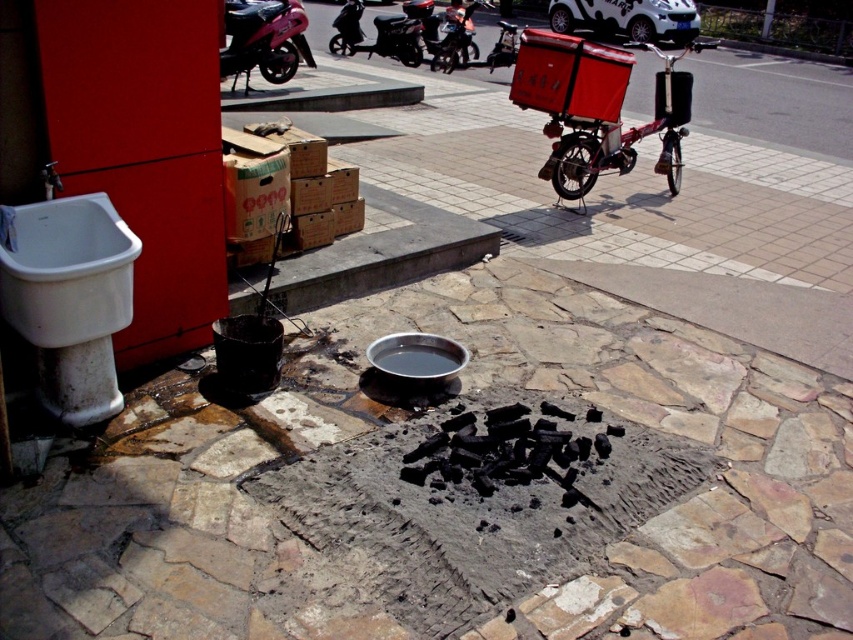
Is smooth stone pavement at center to the left of shiny black motorcycle at upper center from the viewer's perspective?

Incorrect, smooth stone pavement at center is not on the left side of shiny black motorcycle at upper center.

Between smooth stone pavement at center and shiny black motorcycle at upper center, which one appears on the left side from the viewer's perspective?

shiny black motorcycle at upper center is more to the left.

The height and width of the screenshot is (640, 853). What are the coordinates of `smooth stone pavement at center` in the screenshot? It's located at (454, 492).

Image resolution: width=853 pixels, height=640 pixels. I want to click on smooth stone pavement at center, so click(454, 492).

Image resolution: width=853 pixels, height=640 pixels. Describe the element at coordinates (70, 300) in the screenshot. I see `white matte sink at lower left` at that location.

Looking at this image, does white matte sink at lower left have a greater width compared to metallic silver motorcycle at center?

Incorrect, white matte sink at lower left's width does not surpass metallic silver motorcycle at center's.

Which is in front, point (67, 273) or point (448, 54)?

Point (67, 273) is in front.

Locate an element on the screen. The height and width of the screenshot is (640, 853). white matte sink at lower left is located at coordinates (70, 300).

Between shiny black motorcycle at upper center and metallic silver motorcycle at center, which one appears on the right side from the viewer's perspective?

Positioned to the right is metallic silver motorcycle at center.

Is shiny black motorcycle at upper center taller than metallic silver motorcycle at center?

No.

This screenshot has height=640, width=853. What do you see at coordinates (376, 35) in the screenshot? I see `shiny black motorcycle at upper center` at bounding box center [376, 35].

The width and height of the screenshot is (853, 640). Identify the location of shiny black motorcycle at upper center. (376, 35).